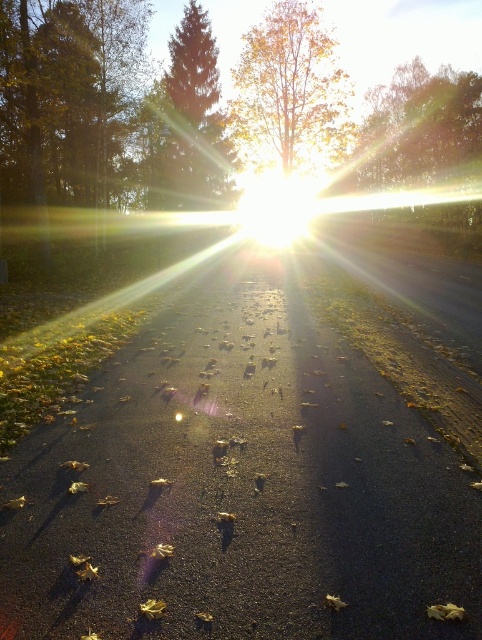
Can you confirm if yellow/golden leaves at upper center is bigger than green matte tree at upper center?

Yes, yellow/golden leaves at upper center is bigger than green matte tree at upper center.

Which is below, yellow/golden leaves at upper center or green matte tree at upper center?

green matte tree at upper center is lower down.

Which is behind, point (269, 106) or point (214, 189)?

The point (269, 106) is more distant.

Find the location of `yellow/golden leaves at upper center`. yellow/golden leaves at upper center is located at coordinates (290, 90).

Who is more forward, [307,64] or [403,131]?

Point [307,64]

Which is more to the right, yellow/golden leaves at upper center or green leafy tree at upper center?

green leafy tree at upper center is more to the right.

The width and height of the screenshot is (482, 640). Find the location of `yellow/golden leaves at upper center`. yellow/golden leaves at upper center is located at coordinates (290, 90).

You are a GUI agent. You are given a task and a screenshot of the screen. Output one action in this format:
    pyautogui.click(x=<x>, y=<y>)
    Task: Click on the green leafy tree at upper center
    This screenshot has height=640, width=482.
    Given the screenshot: What is the action you would take?
    pyautogui.click(x=420, y=129)

Does green leafy tree at upper center have a lesser height compared to green matte tree at upper center?

No, green leafy tree at upper center is not shorter than green matte tree at upper center.

You are a GUI agent. You are given a task and a screenshot of the screen. Output one action in this format:
    pyautogui.click(x=<x>, y=<y>)
    Task: Click on the green leafy tree at upper center
    Image resolution: width=482 pixels, height=640 pixels.
    Given the screenshot: What is the action you would take?
    pyautogui.click(x=420, y=129)